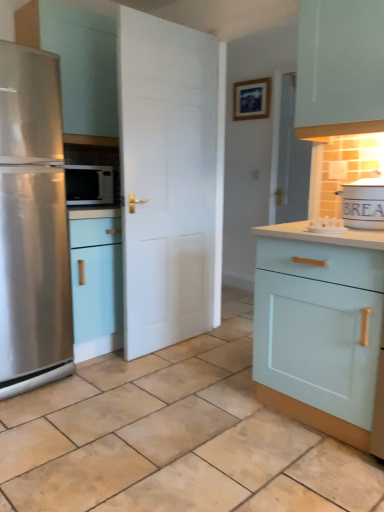
Question: Is stainless steel refrigerator at left spatially inside white matte door at center, or outside of it?

Choices:
 (A) outside
 (B) inside

Answer: (A)

Question: Based on their sizes in the image, would you say stainless steel refrigerator at left is bigger or smaller than white matte door at center?

Choices:
 (A) big
 (B) small

Answer: (A)

Question: Which is farther from the beige tile at center?

Choices:
 (A) white matte door at center
 (B) light blue wood cabinet at right
 (C) white matte tin canister at upper right
 (D) satin black microwave at left
 (E) stainless steel refrigerator at left

Answer: (D)

Question: Estimate the real-world distances between objects in this image. Which object is farther from the white matte door at center?

Choices:
 (A) beige tile at center
 (B) stainless steel refrigerator at left
 (C) light blue wood cabinet at right
 (D) white matte tin canister at upper right
 (E) satin black microwave at left

Answer: (D)